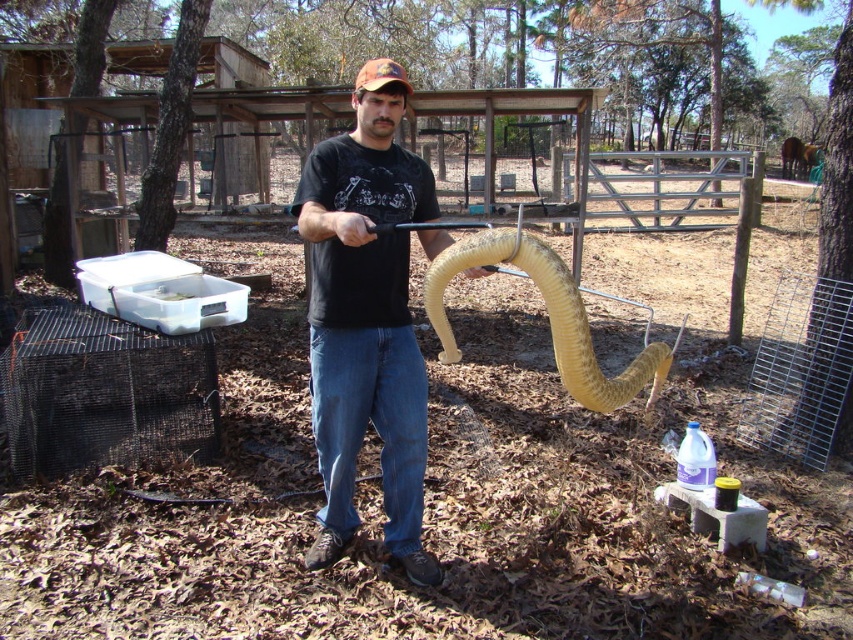
Question: Which of these objects is positioned closest to the black matte shirt at center?

Choices:
 (A) yellow rubber snake at center
 (B) orange fabric baseball cap at center

Answer: (A)

Question: Is yellow rubber snake at center smaller than orange fabric baseball cap at center?

Choices:
 (A) no
 (B) yes

Answer: (B)

Question: Is yellow rubber snake at center to the left of orange fabric baseball cap at center from the viewer's perspective?

Choices:
 (A) yes
 (B) no

Answer: (B)

Question: Which of the following is the farthest from the observer?

Choices:
 (A) black matte shirt at center
 (B) orange fabric baseball cap at center

Answer: (B)

Question: Which point is closer to the camera?

Choices:
 (A) yellow rubber snake at center
 (B) black matte shirt at center

Answer: (A)

Question: Does black matte shirt at center appear on the right side of yellow rubber snake at center?

Choices:
 (A) no
 (B) yes

Answer: (A)